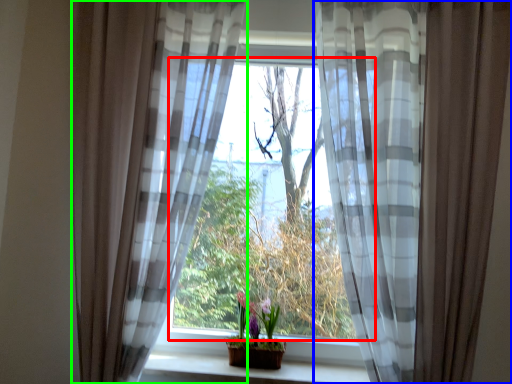
Question: Which is farther away from window (highlighted by a red box)? curtain (highlighted by a blue box) or curtain (highlighted by a green box)?

Choices:
 (A) curtain
 (B) curtain

Answer: (A)